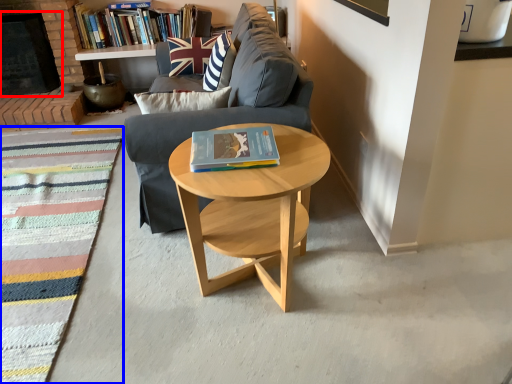
Question: Which point is further to the camera, fireplace (highlighted by a red box) or mat (highlighted by a blue box)?

Choices:
 (A) fireplace
 (B) mat

Answer: (A)